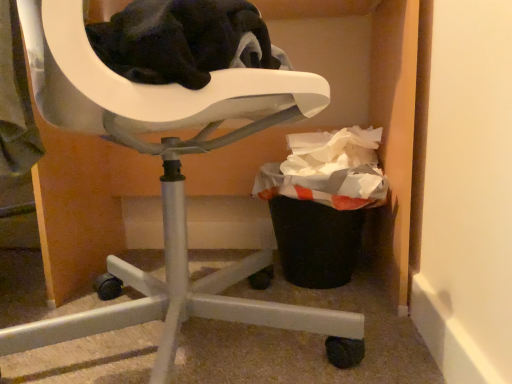
Question: Relative to white plastic chair at upper left, is black plastic trash can at lower right in front or behind?

Choices:
 (A) behind
 (B) front

Answer: (A)

Question: From their relative heights in the image, would you say black plastic trash can at lower right is taller or shorter than white plastic chair at upper left?

Choices:
 (A) short
 (B) tall

Answer: (A)

Question: Is point (292, 183) positioned closer to the camera than point (158, 304)?

Choices:
 (A) farther
 (B) closer

Answer: (A)

Question: Is white plastic chair at upper left spatially inside black plastic trash can at lower right, or outside of it?

Choices:
 (A) inside
 (B) outside

Answer: (B)

Question: In terms of height, does white plastic chair at upper left look taller or shorter compared to black plastic trash can at lower right?

Choices:
 (A) tall
 (B) short

Answer: (A)

Question: Is point (131, 301) positioned closer to the camera than point (270, 177)?

Choices:
 (A) farther
 (B) closer

Answer: (B)

Question: From the image's perspective, relative to black plastic trash can at lower right, is white plastic chair at upper left above or below?

Choices:
 (A) below
 (B) above

Answer: (B)